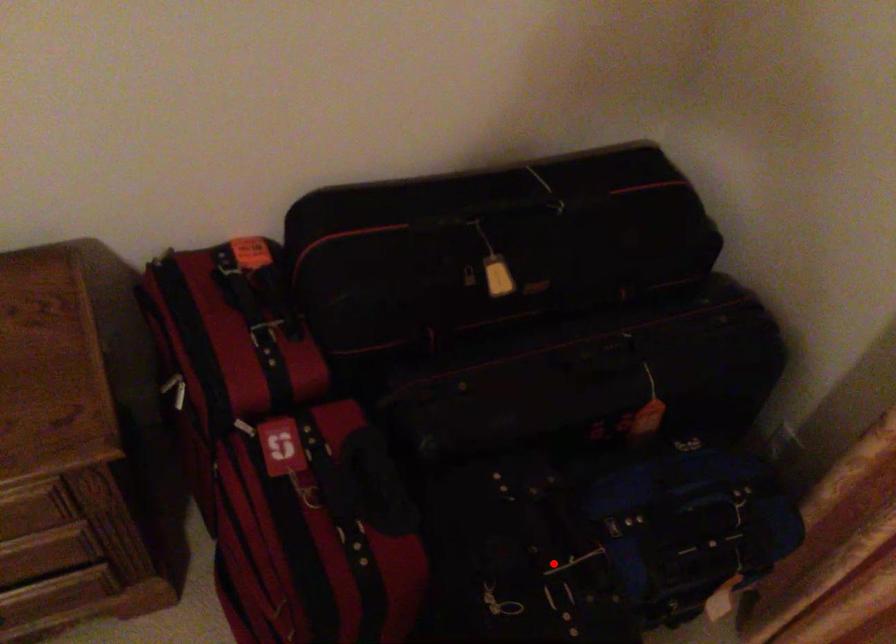
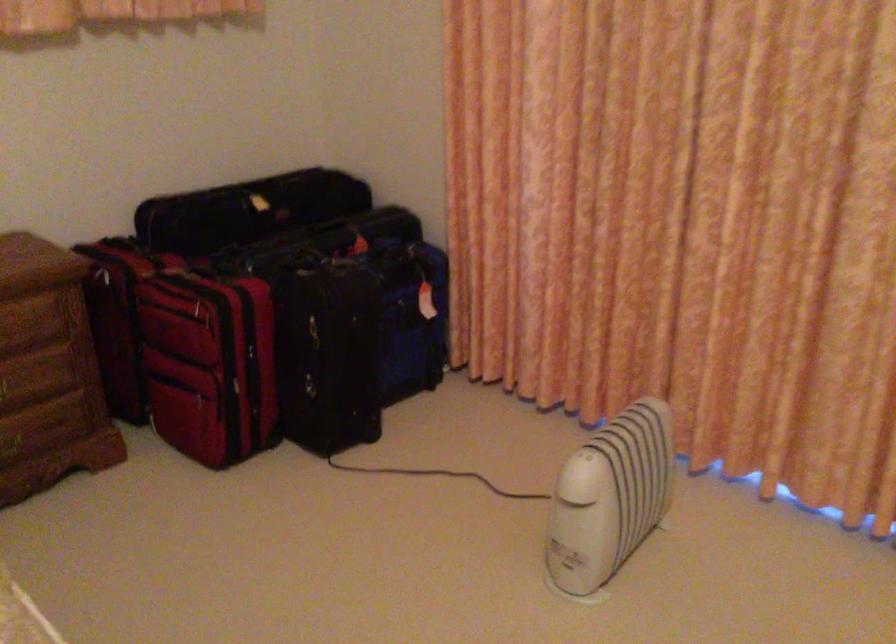
Question: A red point is marked in image1. In image2, is the corresponding 3D point closer to the camera or farther? Reply with the corresponding letter.

Choices:
 (A) The corresponding 3D point is closer.
 (B) The corresponding 3D point is farther.

Answer: (B)